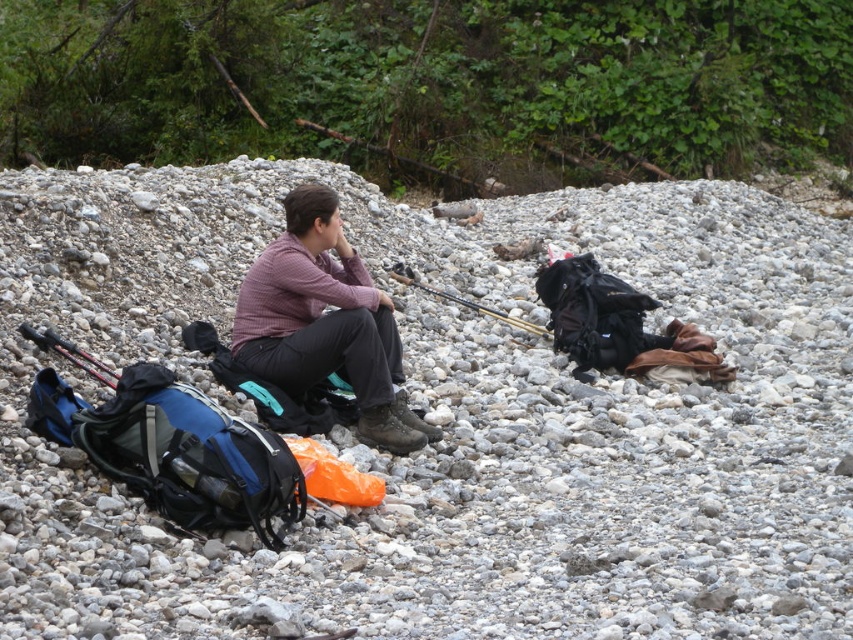
Does matte purple shirt at center have a lesser width compared to matte black fishing pole at center?

Correct, matte purple shirt at center's width is less than matte black fishing pole at center's.

The height and width of the screenshot is (640, 853). What do you see at coordinates (325, 323) in the screenshot?
I see `matte purple shirt at center` at bounding box center [325, 323].

Where is `matte purple shirt at center`? The height and width of the screenshot is (640, 853). matte purple shirt at center is located at coordinates (325, 323).